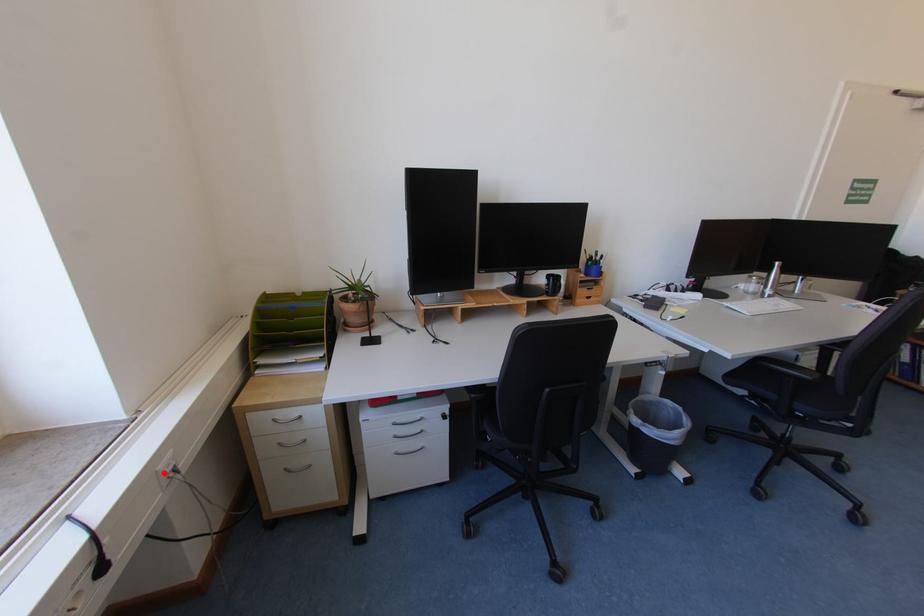
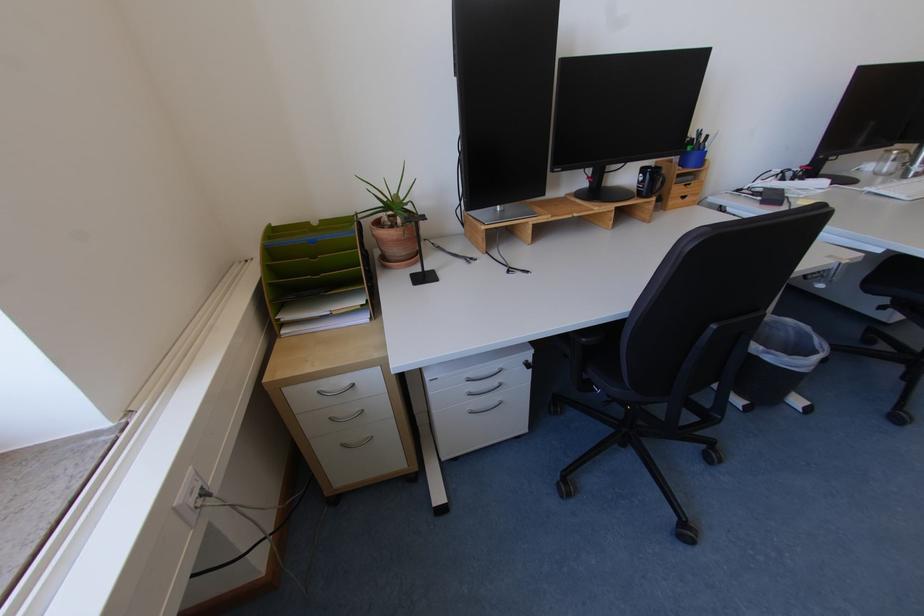
Find the pixel in the second image that matches the highlighted location in the first image.

(181, 509)